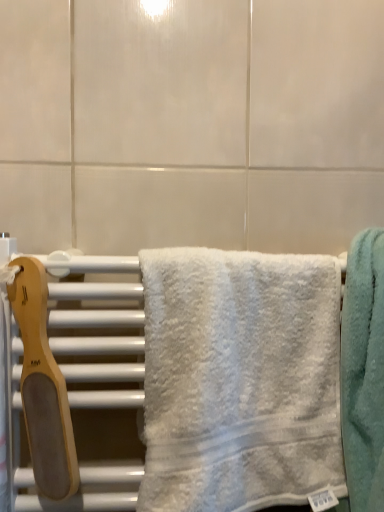
Describe the element at coordinates (240, 379) in the screenshot. The width and height of the screenshot is (384, 512). I see `white fluffy towel at center` at that location.

The image size is (384, 512). In order to click on white fluffy towel at center in this screenshot , I will do `click(240, 379)`.

In order to face white fluffy towel at center, should I rotate leftwards or rightwards?

Rotate your view right by about 7.518°.

Where is `white fluffy towel at center`? white fluffy towel at center is located at coordinates (240, 379).